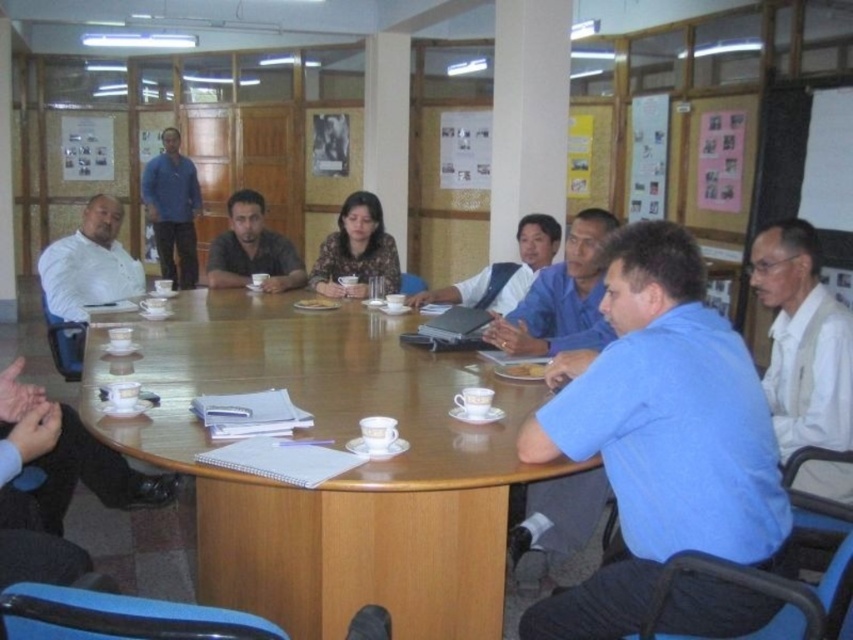
You are a photographer in the meeting room and want to take a photo of the white textured shirt at right and the blue cotton shirt at upper left. Which shirt will appear closer to the camera in the photo?

The white textured shirt at right will appear closer to the camera in the photo because it is positioned in front of the blue cotton shirt at upper left.